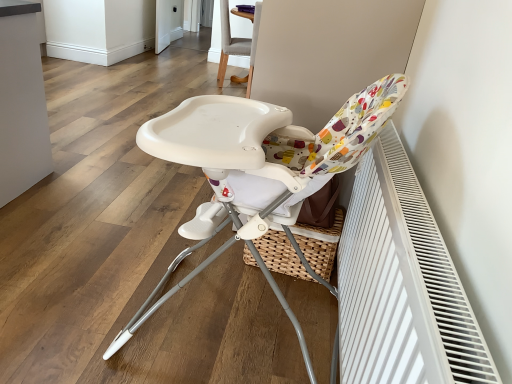
Image resolution: width=512 pixels, height=384 pixels. What do you see at coordinates (402, 284) in the screenshot?
I see `white textured radiator at right` at bounding box center [402, 284].

Locate an element on the screen. The height and width of the screenshot is (384, 512). white glossy screen door at upper center is located at coordinates (168, 23).

The width and height of the screenshot is (512, 384). Find the location of `white textured radiator at right`. white textured radiator at right is located at coordinates (402, 284).

Does point (167, 26) lie in front of point (248, 18)?

No, it is behind (248, 18).

From the image's perspective, which one is positioned higher, white glossy screen door at upper center or light gray fabric chair at upper center, the first chair viewed from the top?

From the image's view, white glossy screen door at upper center is above.

From the picture: Is white glossy screen door at upper center facing towards light gray fabric chair at upper center, the first chair viewed from the top?

No.

From the picture: In terms of height, does white glossy screen door at upper center look taller or shorter compared to light gray fabric chair at upper center, the 2th chair in the front-to-back sequence?

white glossy screen door at upper center is shorter than light gray fabric chair at upper center, the 2th chair in the front-to-back sequence.

In the scene shown: From the image's perspective, who appears lower, white glossy screen door at upper center or white textured radiator at right?

white textured radiator at right is shown below in the image.

Identify the location of air conditioning below the white glossy screen door at upper center (from the image's perspective). 402,284.

How far apart are white glossy screen door at upper center and white textured radiator at right?

They are 5.01 meters apart.

Which of these two, white glossy screen door at upper center or white textured radiator at right, is bigger?

With larger size is white glossy screen door at upper center.

Is white plastic highchair at center, which is counted as the second chair, starting from the back, not near white glossy screen door at upper center?

That's right, there is a large distance between white plastic highchair at center, which is counted as the second chair, starting from the back, and white glossy screen door at upper center.

Based on their sizes in the image, would you say white plastic highchair at center, marked as the 1th chair in a bottom-to-top arrangement, is bigger or smaller than white glossy screen door at upper center?

white plastic highchair at center, marked as the 1th chair in a bottom-to-top arrangement, is bigger than white glossy screen door at upper center.

Between point (342, 142) and point (173, 27), which one is positioned behind?

The point (173, 27) is farther from the camera.

From a real-world perspective, is light gray fabric chair at upper center, the first chair viewed from the back, positioned under white textured radiator at right based on gravity?

Yes, from a real-world perspective, light gray fabric chair at upper center, the first chair viewed from the back, is under white textured radiator at right.

Is light gray fabric chair at upper center, the first chair viewed from the back, bigger or smaller than white textured radiator at right?

In the image, light gray fabric chair at upper center, the first chair viewed from the back, appears to be larger than white textured radiator at right.

Can you confirm if light gray fabric chair at upper center, the 2th chair in the front-to-back sequence, is taller than white textured radiator at right?

Yes.

From the image's perspective, count 2nd chairs upward from the white textured radiator at right and point to it. Please provide its 2D coordinates.

[(238, 43)]

Considering the positions of objects white textured radiator at right and white glossy screen door at upper center in the image provided, who is behind, white textured radiator at right or white glossy screen door at upper center?

white glossy screen door at upper center is further from the camera.

From a real-world perspective, is white textured radiator at right physically below white glossy screen door at upper center?

No, from a real-world perspective, white textured radiator at right is not under white glossy screen door at upper center.

Is white textured radiator at right far away from white glossy screen door at upper center?

Absolutely, white textured radiator at right is distant from white glossy screen door at upper center.

Is white glossy screen door at upper center facing towards white plastic highchair at center, marked as the 1th chair in a bottom-to-top arrangement?

No, white glossy screen door at upper center is not turned towards white plastic highchair at center, marked as the 1th chair in a bottom-to-top arrangement.

Which object is more forward, white glossy screen door at upper center or white plastic highchair at center, the first chair from the front?

white plastic highchair at center, the first chair from the front, is closer to the camera.

Is white glossy screen door at upper center located outside white plastic highchair at center, arranged as the 2th chair when viewed from the top?

Yes.

From the image's perspective, is white plastic highchair at center, which is counted as the second chair, starting from the back, located beneath white textured radiator at right?

Actually, white plastic highchair at center, which is counted as the second chair, starting from the back, appears above white textured radiator at right in the image.

Is white plastic highchair at center, the first chair from the front, beside white textured radiator at right?

They are not placed beside each other.

Could you tell me if white plastic highchair at center, marked as the 1th chair in a bottom-to-top arrangement, is facing white textured radiator at right?

No, white plastic highchair at center, marked as the 1th chair in a bottom-to-top arrangement, is not aimed at white textured radiator at right.

From a real-world perspective, who is located lower, white plastic highchair at center, marked as the 1th chair in a bottom-to-top arrangement, or white textured radiator at right?

In real-world perspective, white textured radiator at right is lower.

Where is `chair that is the 1st one when counting downward from the white glossy screen door at upper center (from the image's perspective)`? chair that is the 1st one when counting downward from the white glossy screen door at upper center (from the image's perspective) is located at coordinates (238, 43).

Locate an element on the screen. This screenshot has height=384, width=512. screen door located behind the white textured radiator at right is located at coordinates (168, 23).

Considering their positions, is white plastic highchair at center, which is counted as the second chair, starting from the back, positioned further to light gray fabric chair at upper center, the 2th chair in the front-to-back sequence, than white glossy screen door at upper center?

white plastic highchair at center, which is counted as the second chair, starting from the back, is further to light gray fabric chair at upper center, the 2th chair in the front-to-back sequence.

When comparing their distances from light gray fabric chair at upper center, the 2th chair in the front-to-back sequence, does white plastic highchair at center, which is counted as the second chair, starting from the back, or white textured radiator at right seem further?

The object further to light gray fabric chair at upper center, the 2th chair in the front-to-back sequence, is white textured radiator at right.

Which object lies nearer to the anchor point white textured radiator at right, white plastic highchair at center, the first chair from the front, or white glossy screen door at upper center?

Among the two, white plastic highchair at center, the first chair from the front, is located nearer to white textured radiator at right.

When comparing their distances from white textured radiator at right, does white glossy screen door at upper center or white plastic highchair at center, arranged as the 2th chair when viewed from the top, seem further?

Based on the image, white glossy screen door at upper center appears to be further to white textured radiator at right.

Based on their spatial positions, is white plastic highchair at center, arranged as the 2th chair when viewed from the top, or white textured radiator at right closer to white glossy screen door at upper center?

white plastic highchair at center, arranged as the 2th chair when viewed from the top, is closer to white glossy screen door at upper center.

Considering their positions, is white textured radiator at right positioned further to white glossy screen door at upper center than light gray fabric chair at upper center, the first chair viewed from the top?

white textured radiator at right is positioned further to the anchor white glossy screen door at upper center.

Considering their positions, is white glossy screen door at upper center positioned further to white textured radiator at right than light gray fabric chair at upper center, which is the second chair from bottom to top?

white glossy screen door at upper center is further to white textured radiator at right.

Which object lies nearer to the anchor point white textured radiator at right, white plastic highchair at center, the first chair from the front, or light gray fabric chair at upper center, the 2th chair in the front-to-back sequence?

white plastic highchair at center, the first chair from the front.

Where is `chair between white textured radiator at right and light gray fabric chair at upper center, which is the second chair from bottom to top, from front to back`? chair between white textured radiator at right and light gray fabric chair at upper center, which is the second chair from bottom to top, from front to back is located at coordinates (257, 166).

Image resolution: width=512 pixels, height=384 pixels. I want to click on chair located between white plastic highchair at center, the first chair from the front, and white glossy screen door at upper center in the depth direction, so click(238, 43).